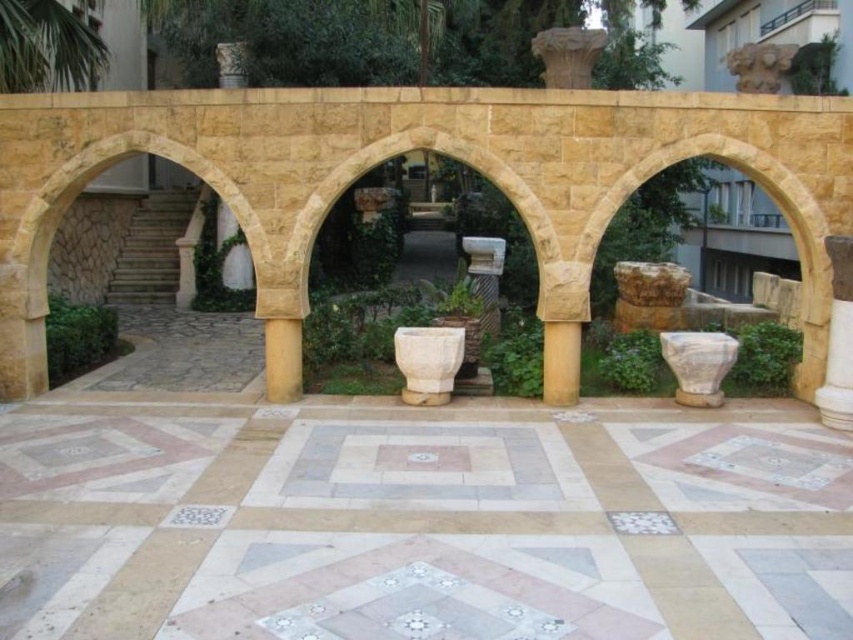
You are standing at the entrance of the archway and want to place a new decorative item exactly at the center of the white stone urn at center. What coordinates should you aim for?

The white stone urn at center is located at coordinates point [428,362], so you should aim for those coordinates to place the new decorative item exactly at its center.

You are an architect designing a garden layout. You need to place a new statue that requires a base taller than 2 meters. Which object between the white stone urn at center and the smooth stone column at center would be more suitable as a base for the statue?

The smooth stone column at center is taller than the white stone urn at center, so it would be more suitable as a base for the statue that requires a base taller than 2 meters.